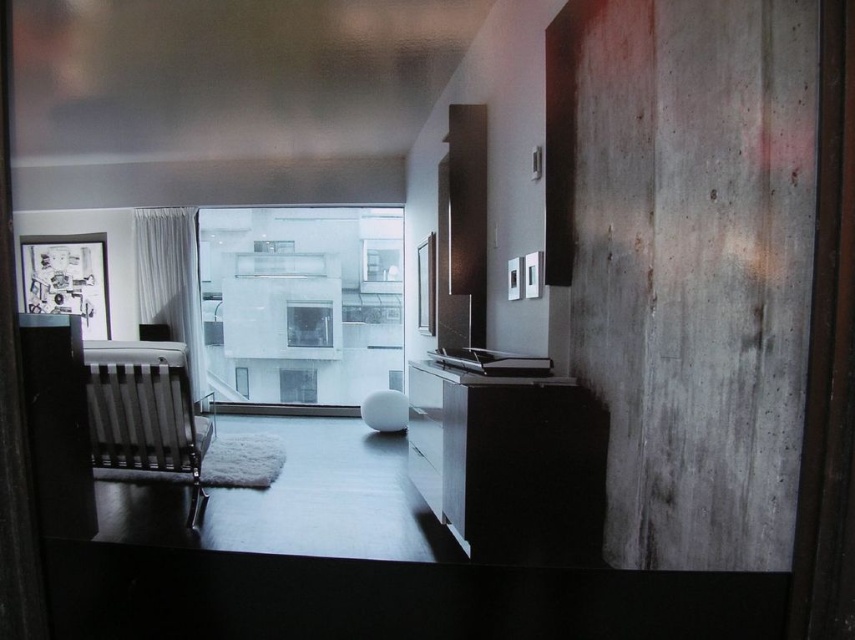
Can you confirm if black textured rocking chair at left is wider than matte black cabinet at left?

Correct, the width of black textured rocking chair at left exceeds that of matte black cabinet at left.

Does black textured rocking chair at left have a lesser height compared to matte black cabinet at left?

Yes, black textured rocking chair at left is shorter than matte black cabinet at left.

Who is more forward, (99, 445) or (43, 508)?

Point (43, 508) is in front.

You are a GUI agent. You are given a task and a screenshot of the screen. Output one action in this format:
    pyautogui.click(x=<x>, y=<y>)
    Task: Click on the black textured rocking chair at left
    This screenshot has width=855, height=640.
    Given the screenshot: What is the action you would take?
    pyautogui.click(x=145, y=412)

Does matte black cabinet at left have a lesser width compared to transparent glass window at center?

No.

Where is `matte black cabinet at left`? matte black cabinet at left is located at coordinates (57, 422).

Can you confirm if black textured rocking chair at left is positioned below transparent glass window at center?

Yes.

Identify the location of black textured rocking chair at left. This screenshot has width=855, height=640. (145, 412).